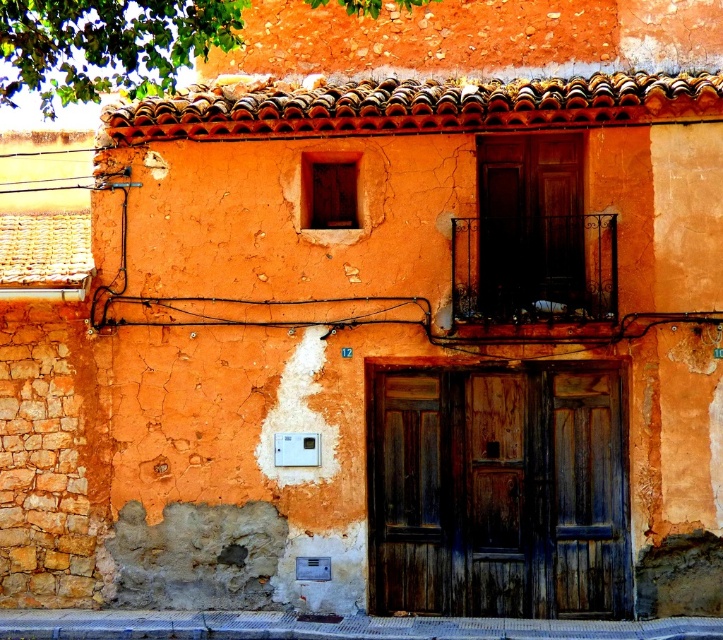
Question: Is terracotta tiles at upper center bigger than wooden door at center?

Choices:
 (A) yes
 (B) no

Answer: (A)

Question: Does dark brown wooden door at center have a greater width compared to terracotta tiles at upper center?

Choices:
 (A) no
 (B) yes

Answer: (A)

Question: Which object is positioned closest to the dark brown wooden door at center?

Choices:
 (A) terracotta tiles at upper center
 (B) wooden door at center

Answer: (B)

Question: Which is farther from the terracotta tiles at upper center?

Choices:
 (A) dark brown wooden door at center
 (B) wooden door at center

Answer: (A)

Question: Which of the following is the closest to the observer?

Choices:
 (A) (604, 589)
 (B) (500, 292)
 (C) (359, 99)

Answer: (A)

Question: Does dark brown wooden door at center have a lesser width compared to wooden door at center?

Choices:
 (A) yes
 (B) no

Answer: (B)